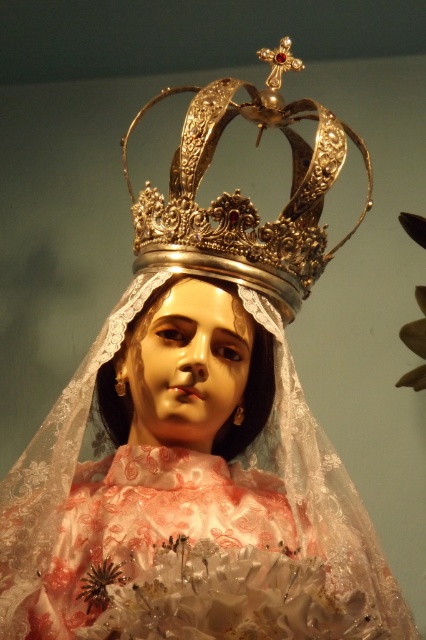
You are an art conservator examining the statue. You need to determine if the gold metallic crown at upper center will fit into a storage box designed for objects no taller than the matte porcelain head at center. Based on their heights, will the crown fit?

The gold metallic crown at upper center has a greater height compared to the matte porcelain head at center, so it will not fit into the storage box designed for objects no taller than the matte porcelain head at center.

You are an art conservator working on a statue. You need to ensure that the gold metallic crown at upper center is securely attached to the matte porcelain head at center. Given that the recommended safe distance between the crown and head for stability is 10 inches, is the current distance sufficient?

The distance between the gold metallic crown at upper center and the matte porcelain head at center is 9.78 inches, which is slightly less than the recommended 10 inches. Therefore, the current distance may not be sufficient for optimal stability.